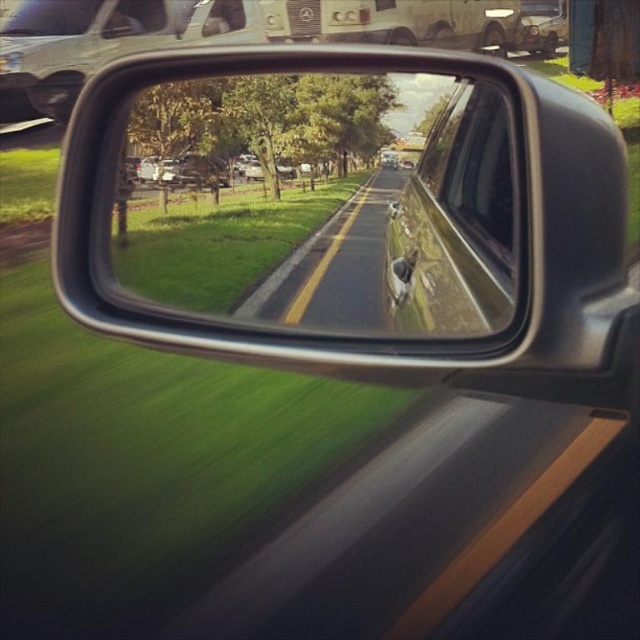
Is point (310, 113) farther from camera compared to point (483, 198)?

That is True.

Does glossy reflective road at center have a lesser height compared to transparent glass car window at center?

No.

Who is more forward, (x=132, y=248) or (x=428, y=154)?

Point (x=428, y=154)

At what (x,y) coordinates should I click in order to perform the action: click on glossy reflective road at center. Please return your answer as a coordinate pair (x, y). Looking at the image, I should click on (323, 202).

The width and height of the screenshot is (640, 640). I want to click on glossy metallic mirror at center, so click(358, 220).

At what (x,y) coordinates should I click in order to perform the action: click on glossy metallic mirror at center. Please return your answer as a coordinate pair (x, y). Image resolution: width=640 pixels, height=640 pixels. Looking at the image, I should click on (358, 220).

Looking at this image, does glossy metallic mirror at center have a lesser width compared to glossy reflective road at center?

In fact, glossy metallic mirror at center might be wider than glossy reflective road at center.

Describe the element at coordinates (358, 220) in the screenshot. I see `glossy metallic mirror at center` at that location.

Identify the location of glossy metallic mirror at center. coord(358,220).